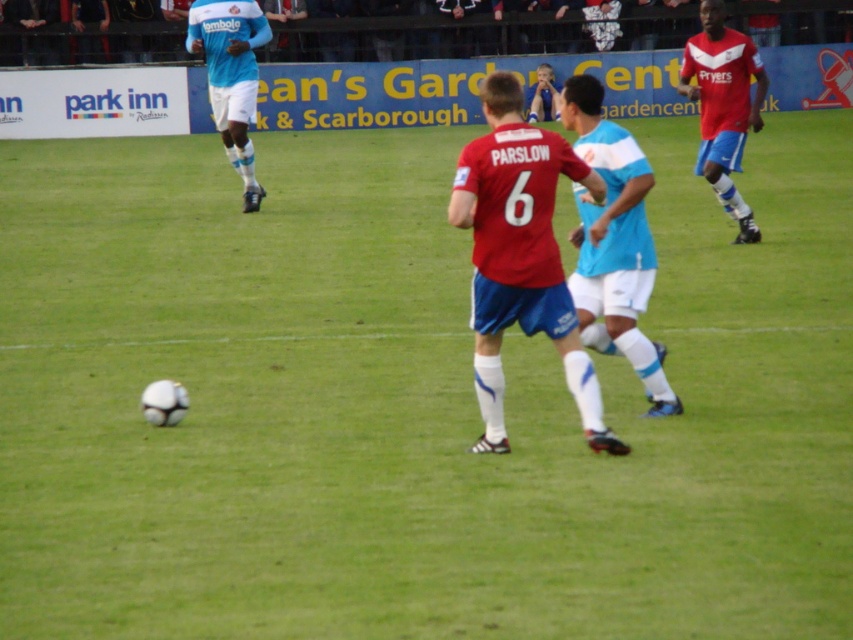
Who is taller, matte red jersey at center or red jersey at right?

Standing taller between the two is red jersey at right.

Image resolution: width=853 pixels, height=640 pixels. Describe the element at coordinates (520, 256) in the screenshot. I see `matte red jersey at center` at that location.

Does point (534, 170) come farther from viewer compared to point (735, 109)?

No, it is in front of (735, 109).

Image resolution: width=853 pixels, height=640 pixels. In order to click on matte red jersey at center in this screenshot , I will do `click(520, 256)`.

Does matte red jersey at center appear on the right side of light blue jersey at center?

Correct, you'll find matte red jersey at center to the right of light blue jersey at center.

Does matte red jersey at center appear on the left side of light blue jersey at center?

In fact, matte red jersey at center is to the right of light blue jersey at center.

Which is in front, point (495, 285) or point (235, 99)?

Point (495, 285)

This screenshot has width=853, height=640. Identify the location of matte red jersey at center. click(520, 256).

Which is in front, point (631, 356) or point (746, 108)?

Point (631, 356) is more forward.

This screenshot has height=640, width=853. I want to click on blue/white jersey at center, so click(613, 243).